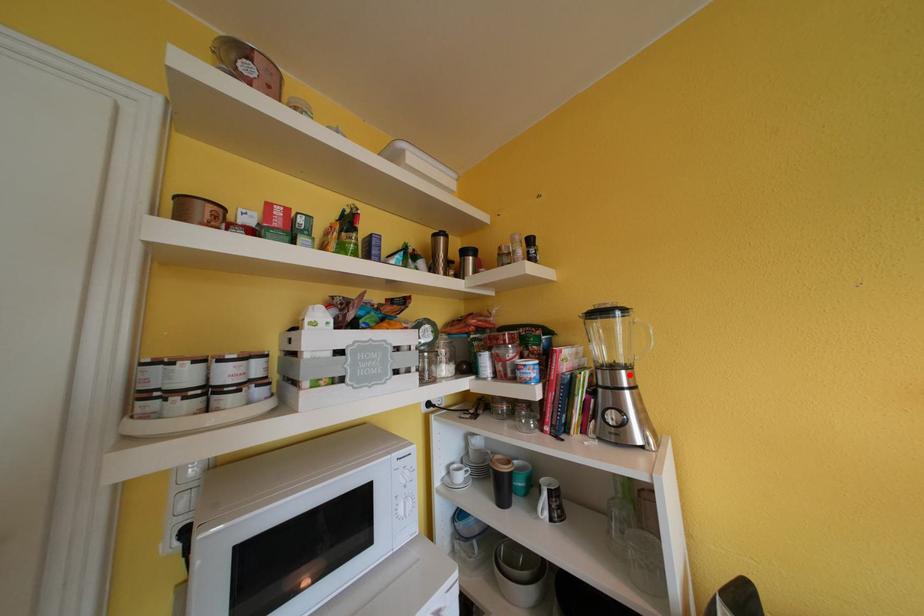
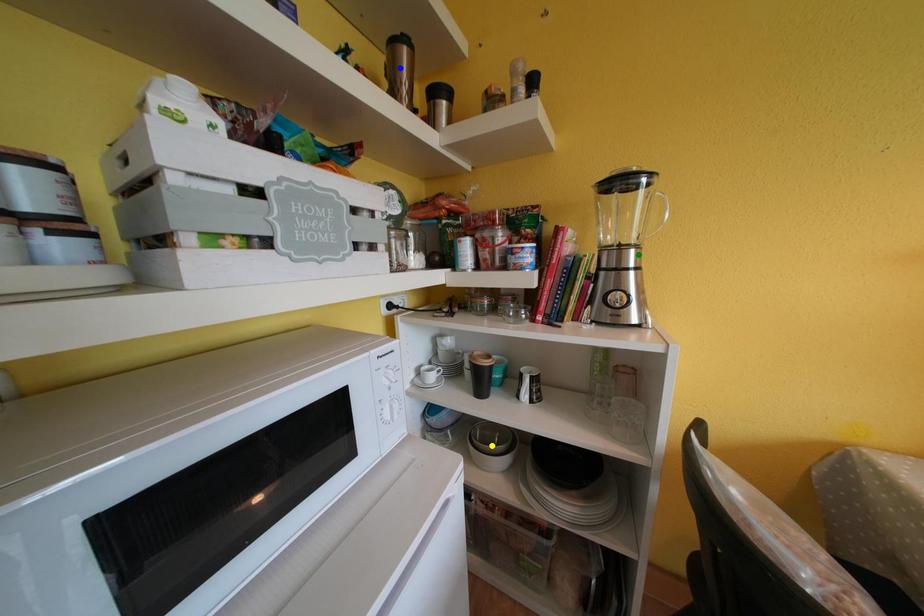
Question: I am providing you with two images of the same scene from different viewpoints. A red point is marked on the first image. You are given multiple points on the second image. Which spot in image 2 lines up with the point in image 1?

Choices:
 (A) green point
 (B) blue point
 (C) yellow point

Answer: (A)